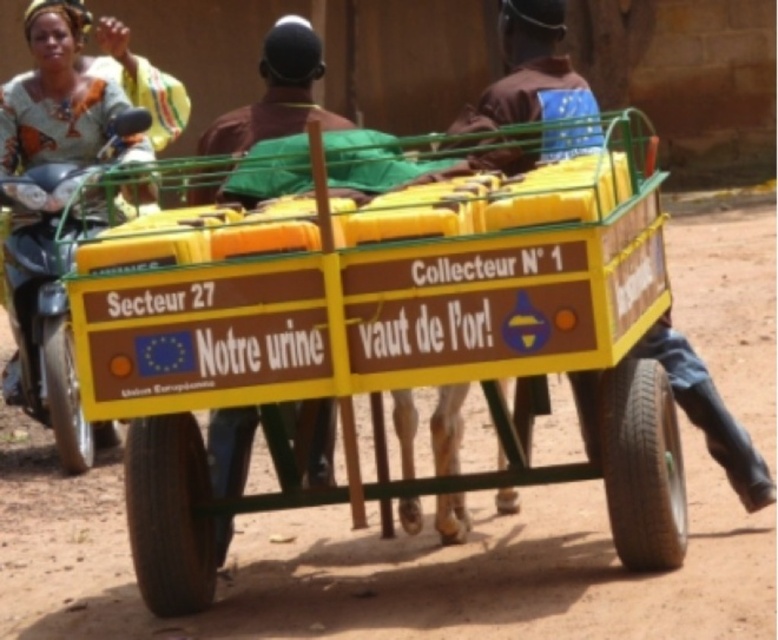
Question: Which of the following is the farthest from the observer?

Choices:
 (A) metallic silver motorcycle at left
 (B) yellow plastic cart at center
 (C) brown leather jacket at center

Answer: (A)

Question: Which of the following is the closest to the observer?

Choices:
 (A) (492, 209)
 (B) (741, 488)

Answer: (A)

Question: Where is brown leather jacket at center located in relation to metallic silver motorcycle at left in the image?

Choices:
 (A) below
 (B) above

Answer: (B)

Question: Which point is farther from the camera taking this photo?

Choices:
 (A) (27, 392)
 (B) (166, 579)

Answer: (A)

Question: Is yellow plastic cart at center above metallic silver motorcycle at left?

Choices:
 (A) yes
 (B) no

Answer: (B)

Question: Is yellow plastic cart at center to the right of brown leather jacket at center from the viewer's perspective?

Choices:
 (A) no
 (B) yes

Answer: (A)